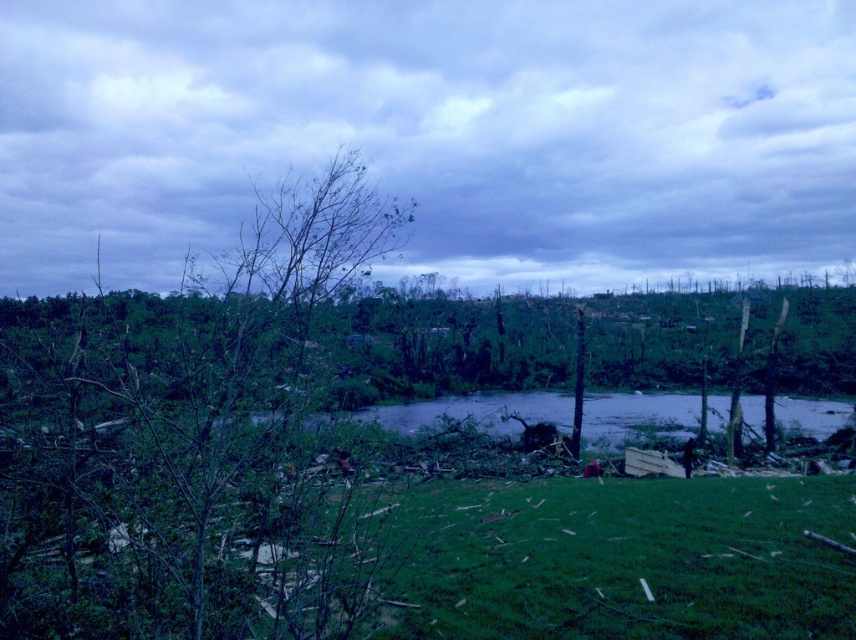
Which is behind, point (141, 410) or point (810, 604)?

The point (810, 604) is behind.

Can you confirm if green leafy tree at center is positioned above green grass at lower center?

Yes, green leafy tree at center is above green grass at lower center.

Is point (40, 579) positioned in front of point (735, 560)?

Yes, it is.

Identify the location of green leafy tree at center. (183, 438).

Which is above, green leafy tree at center or clear water at center?

Positioned higher is green leafy tree at center.

Does green leafy tree at center appear on the right side of clear water at center?

In fact, green leafy tree at center is to the left of clear water at center.

Which is behind, point (100, 355) or point (449, 397)?

Positioned behind is point (449, 397).

The height and width of the screenshot is (640, 856). I want to click on green leafy tree at center, so click(x=183, y=438).

Is green grass at lower center wider than clear water at center?

No.

Who is positioned more to the left, green grass at lower center or clear water at center?

From the viewer's perspective, green grass at lower center appears more on the left side.

Describe the element at coordinates (613, 557) in the screenshot. The image size is (856, 640). I see `green grass at lower center` at that location.

I want to click on green grass at lower center, so click(613, 557).